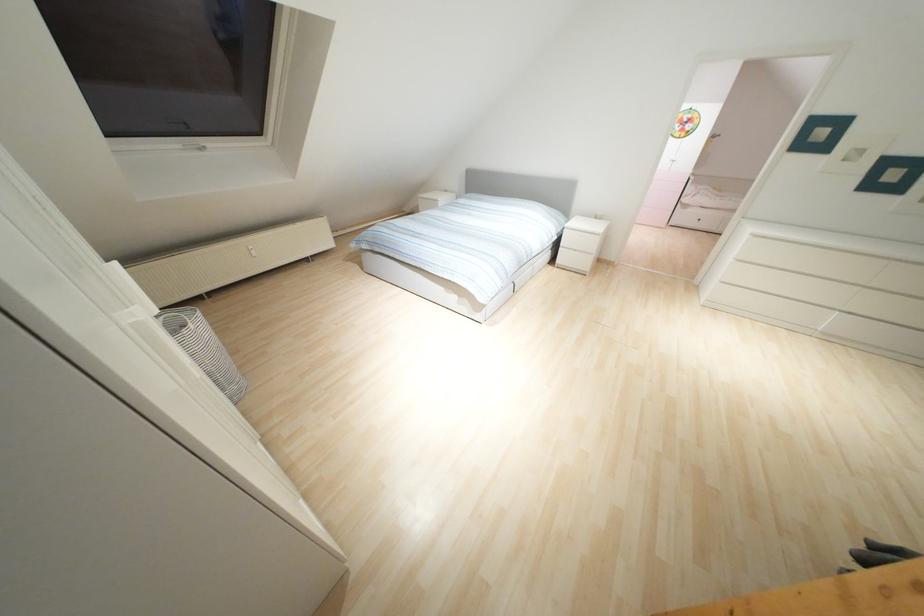
This screenshot has height=616, width=924. What do you see at coordinates (193, 146) in the screenshot? I see `a white window handle` at bounding box center [193, 146].